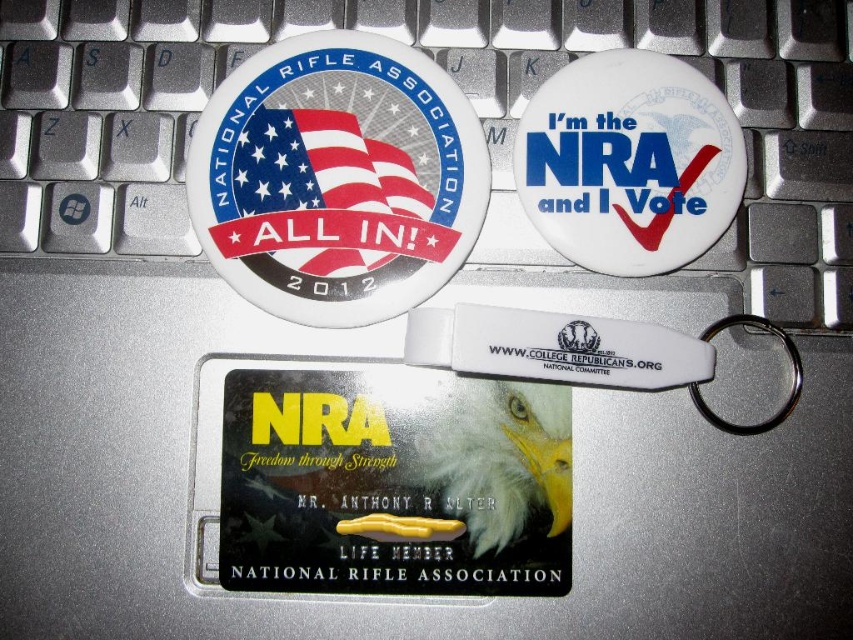
Question: Which object is the closest to the white matte button at upper right?

Choices:
 (A) white matte eagle at center
 (B) matte white button at center
 (C) white plastic keychain at center

Answer: (C)

Question: Which of these objects is positioned closest to the matte white button at center?

Choices:
 (A) white matte button at upper right
 (B) white plastic keychain at center

Answer: (A)

Question: Is white matte button at upper right to the right of white plastic keychain at center from the viewer's perspective?

Choices:
 (A) no
 (B) yes

Answer: (A)

Question: Is matte white button at center to the left of white matte eagle at center from the viewer's perspective?

Choices:
 (A) no
 (B) yes

Answer: (B)

Question: Is white matte button at upper right positioned before white plastic keychain at center?

Choices:
 (A) yes
 (B) no

Answer: (B)

Question: Which object is positioned closest to the white matte eagle at center?

Choices:
 (A) white matte button at upper right
 (B) white plastic keychain at center
 (C) matte white button at center

Answer: (B)